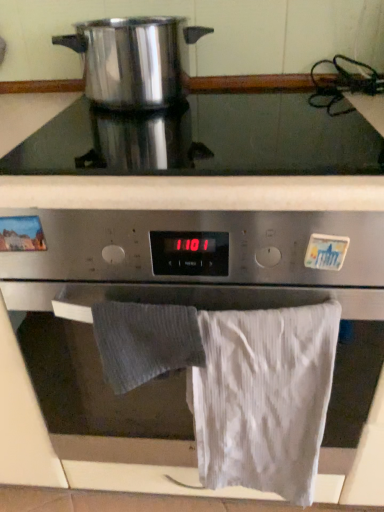
Question: From a real-world perspective, is gray textured towel at lower center, acting as the second bath towel starting from the right, below polished stainless steel pot at upper left?

Choices:
 (A) yes
 (B) no

Answer: (A)

Question: Considering the relative sizes of gray textured towel at lower center, acting as the second bath towel starting from the right, and polished stainless steel pot at upper left in the image provided, is gray textured towel at lower center, acting as the second bath towel starting from the right, wider than polished stainless steel pot at upper left?

Choices:
 (A) yes
 (B) no

Answer: (B)

Question: Is the depth of gray textured towel at lower center, acting as the second bath towel starting from the right, greater than that of polished stainless steel pot at upper left?

Choices:
 (A) no
 (B) yes

Answer: (A)

Question: From the image's perspective, is gray textured towel at lower center, the 1th bath towel in the left-to-right sequence, beneath polished stainless steel pot at upper left?

Choices:
 (A) yes
 (B) no

Answer: (A)

Question: Is gray textured towel at lower center, the 1th bath towel in the left-to-right sequence, looking in the opposite direction of polished stainless steel pot at upper left?

Choices:
 (A) yes
 (B) no

Answer: (B)

Question: From a real-world perspective, is gray textured towel at lower center, acting as the second bath towel starting from the right, physically above polished stainless steel pot at upper left?

Choices:
 (A) yes
 (B) no

Answer: (B)

Question: Is satin silver cooktop at upper center taller than gray textured towel at lower center, acting as the second bath towel starting from the right?

Choices:
 (A) yes
 (B) no

Answer: (B)

Question: From the image's perspective, is satin silver cooktop at upper center on top of gray textured towel at lower center, acting as the second bath towel starting from the right?

Choices:
 (A) yes
 (B) no

Answer: (A)

Question: Is satin silver cooktop at upper center behind gray textured towel at lower center, acting as the second bath towel starting from the right?

Choices:
 (A) yes
 (B) no

Answer: (A)

Question: Would you consider satin silver cooktop at upper center to be distant from gray textured towel at lower center, the 1th bath towel in the left-to-right sequence?

Choices:
 (A) no
 (B) yes

Answer: (A)

Question: From a real-world perspective, is satin silver cooktop at upper center physically below gray textured towel at lower center, acting as the second bath towel starting from the right?

Choices:
 (A) yes
 (B) no

Answer: (B)

Question: Is satin silver cooktop at upper center completely or partially outside of gray textured towel at lower center, the 1th bath towel in the left-to-right sequence?

Choices:
 (A) yes
 (B) no

Answer: (A)

Question: From a real-world perspective, is white cotton towel at lower right, arranged as the first bath towel when viewed from the right, physically below gray textured towel at lower center, acting as the second bath towel starting from the right?

Choices:
 (A) yes
 (B) no

Answer: (A)